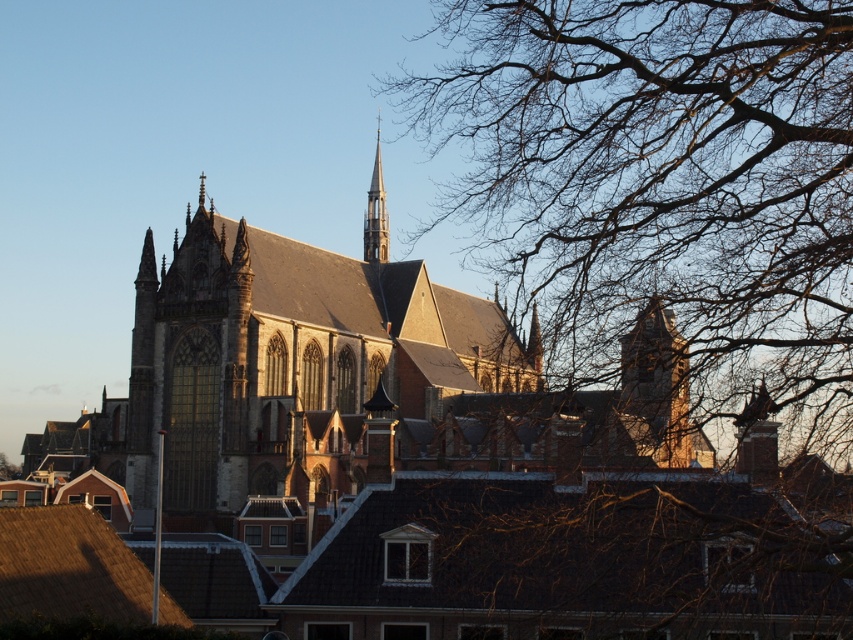
Question: Which of the following is the closest to the observer?

Choices:
 (A) bare branches at upper right
 (B) smooth gray steeple at center

Answer: (A)

Question: Can you confirm if bare branches at upper right is positioned to the right of smooth gray steeple at center?

Choices:
 (A) no
 (B) yes

Answer: (B)

Question: Can you confirm if bare branches at upper right is bigger than smooth gray steeple at center?

Choices:
 (A) yes
 (B) no

Answer: (A)

Question: Which point is closer to the camera?

Choices:
 (A) smooth gray steeple at center
 (B) bare branches at upper right

Answer: (B)

Question: Does bare branches at upper right lie in front of smooth gray steeple at center?

Choices:
 (A) no
 (B) yes

Answer: (B)